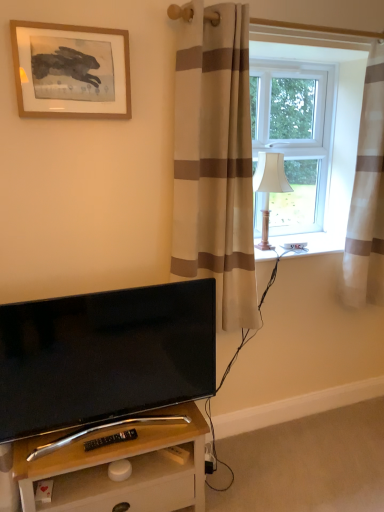
Image resolution: width=384 pixels, height=512 pixels. In order to click on free spot below beige striped curtain at center, positioned as the second curtain in right-to-left order (from a real-world perspective) in this screenshot , I will do `click(224, 446)`.